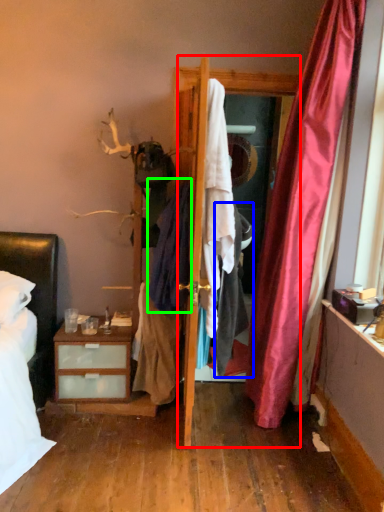
Question: Based on their relative distances, which object is nearer to screen door (highlighted by a red box)? Choose from clothing (highlighted by a blue box) and clothing (highlighted by a green box).

Choices:
 (A) clothing
 (B) clothing

Answer: (B)